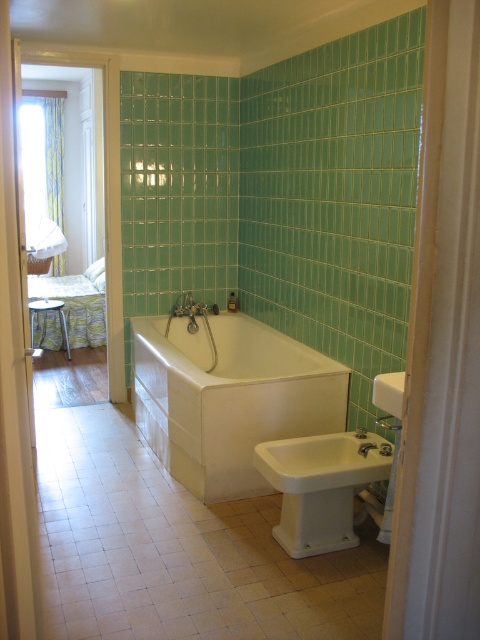
You are standing in the bathroom and need to locate the white glossy bathtub at center. According to the coordinates provided, where would you find it?

The white glossy bathtub at center is located at coordinates point (228, 397).

You are a plumber trying to locate the white ceramic sink at center in the bathroom. According to the coordinates given, where would you find it?

The white ceramic sink at center is located at coordinates point [388,392].

You are standing in the bathroom and want to locate the point at coordinates (388, 392). According to the scene description, where exactly is this point located?

The point at coordinates (388, 392) is on the white ceramic sink at center.